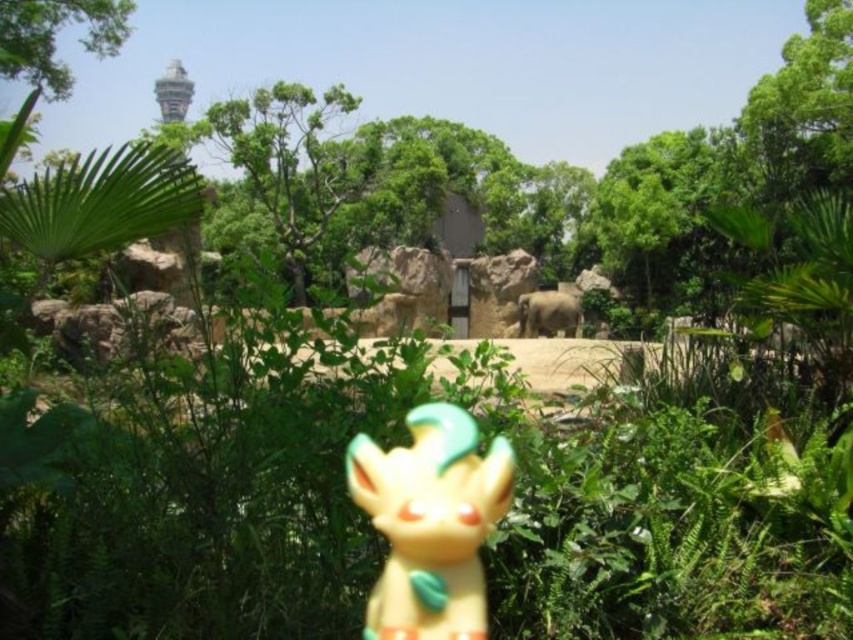
The width and height of the screenshot is (853, 640). What do you see at coordinates (430, 522) in the screenshot?
I see `yellow matte figurine at center` at bounding box center [430, 522].

Is point (450, 625) farther from camera compared to point (42, 16)?

No, (450, 625) is closer to viewer.

Who is more forward, (396, 497) or (109, 51)?

Point (396, 497)

Where is `yellow matte figurine at center`? The width and height of the screenshot is (853, 640). yellow matte figurine at center is located at coordinates (430, 522).

From the picture: Does yellow matte figurine at center appear over gray matte elephant at center?

No, yellow matte figurine at center is not above gray matte elephant at center.

Measure the distance between point (x=444, y=502) and camera.

Point (x=444, y=502) is 1.65 meters from camera.

At what (x,y) coordinates should I click in order to perform the action: click on yellow matte figurine at center. Please return your answer as a coordinate pair (x, y). Looking at the image, I should click on (x=430, y=522).

Locate an element on the screen. yellow matte figurine at center is located at coordinates (430, 522).

Who is shorter, green leafy tree at upper left or gray matte elephant at center?

With less height is green leafy tree at upper left.

Which is behind, point (47, 80) or point (573, 301)?

The point (573, 301) is behind.

Locate an element on the screen. The width and height of the screenshot is (853, 640). green leafy tree at upper left is located at coordinates (56, 36).